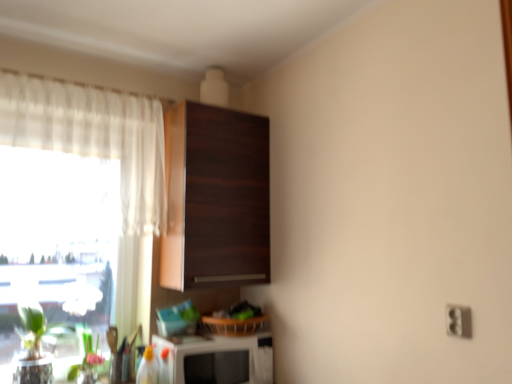
Question: Does white plastic electric outlet at lower right have a smaller size compared to white sheer curtain at left?

Choices:
 (A) no
 (B) yes

Answer: (B)

Question: From the image's perspective, is white plastic electric outlet at lower right under white sheer curtain at left?

Choices:
 (A) no
 (B) yes

Answer: (B)

Question: Does white plastic electric outlet at lower right have a lesser height compared to white sheer curtain at left?

Choices:
 (A) yes
 (B) no

Answer: (A)

Question: Is white plastic electric outlet at lower right facing towards white sheer curtain at left?

Choices:
 (A) no
 (B) yes

Answer: (A)

Question: Does white plastic electric outlet at lower right lie behind white sheer curtain at left?

Choices:
 (A) no
 (B) yes

Answer: (A)

Question: In terms of width, does white sheer curtain at left look wider or thinner when compared to green matte plant at lower left?

Choices:
 (A) wide
 (B) thin

Answer: (B)

Question: Choose the correct answer: Is white sheer curtain at left inside green matte plant at lower left or outside it?

Choices:
 (A) inside
 (B) outside

Answer: (B)

Question: From the image's perspective, is white sheer curtain at left above or below green matte plant at lower left?

Choices:
 (A) above
 (B) below

Answer: (A)

Question: Is white sheer curtain at left bigger or smaller than green matte plant at lower left?

Choices:
 (A) big
 (B) small

Answer: (A)

Question: Would you say dark wood cabinet at upper center is to the left or to the right of white sheer curtain at left in the picture?

Choices:
 (A) right
 (B) left

Answer: (A)

Question: In terms of width, does dark wood cabinet at upper center look wider or thinner when compared to white sheer curtain at left?

Choices:
 (A) thin
 (B) wide

Answer: (B)

Question: From a real-world perspective, is dark wood cabinet at upper center above or below white sheer curtain at left?

Choices:
 (A) below
 (B) above

Answer: (A)

Question: Is point (170, 180) closer or farther from the camera than point (93, 112)?

Choices:
 (A) closer
 (B) farther

Answer: (B)

Question: Considering their positions, is dark wood cabinet at upper center located in front of or behind white glossy microwave at lower center?

Choices:
 (A) front
 (B) behind

Answer: (B)

Question: Looking at the image, does dark wood cabinet at upper center seem bigger or smaller compared to white glossy microwave at lower center?

Choices:
 (A) big
 (B) small

Answer: (A)